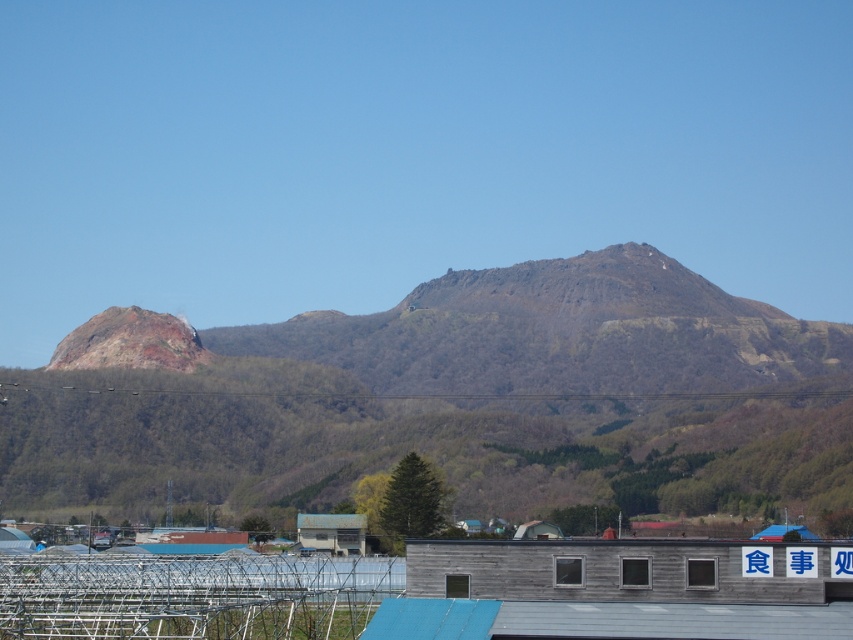
Is rustic brown mountain range at center shorter than wooden hut at center?

No, rustic brown mountain range at center is not shorter than wooden hut at center.

Image resolution: width=853 pixels, height=640 pixels. I want to click on rustic brown mountain range at center, so click(x=456, y=401).

Does wooden hut at lower center have a greater width compared to wooden hut at center?

Correct, the width of wooden hut at lower center exceeds that of wooden hut at center.

Is wooden hut at lower center smaller than wooden hut at center?

Yes.

The image size is (853, 640). What do you see at coordinates (628, 570) in the screenshot?
I see `wooden hut at lower center` at bounding box center [628, 570].

You are a GUI agent. You are given a task and a screenshot of the screen. Output one action in this format:
    pyautogui.click(x=<x>, y=<y>)
    Task: Click on the wooden hut at lower center
    Image resolution: width=853 pixels, height=640 pixels.
    Given the screenshot: What is the action you would take?
    pyautogui.click(x=628, y=570)

Between point (769, 444) and point (724, 586), which one is positioned behind?

The point (769, 444) is behind.

Is rustic brown mountain range at center bigger than wooden hut at lower center?

Yes.

The image size is (853, 640). What do you see at coordinates (456, 401) in the screenshot?
I see `rustic brown mountain range at center` at bounding box center [456, 401].

I want to click on rustic brown mountain range at center, so click(x=456, y=401).